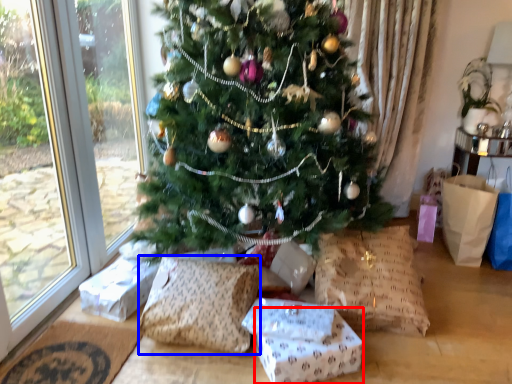
Question: Which object is further to the camera taking this photo, gift box (highlighted by a red box) or pillow (highlighted by a blue box)?

Choices:
 (A) gift box
 (B) pillow

Answer: (B)